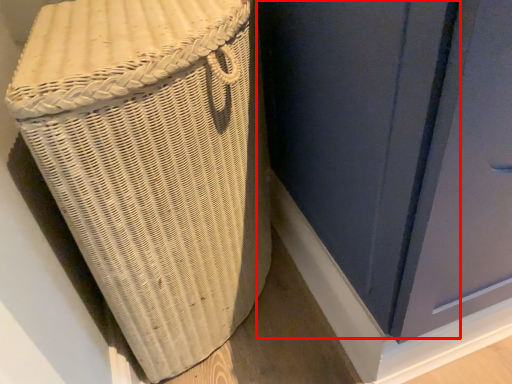
Question: In this image, where is screen door (annotated by the red box) located relative to furniture?

Choices:
 (A) left
 (B) right

Answer: (B)